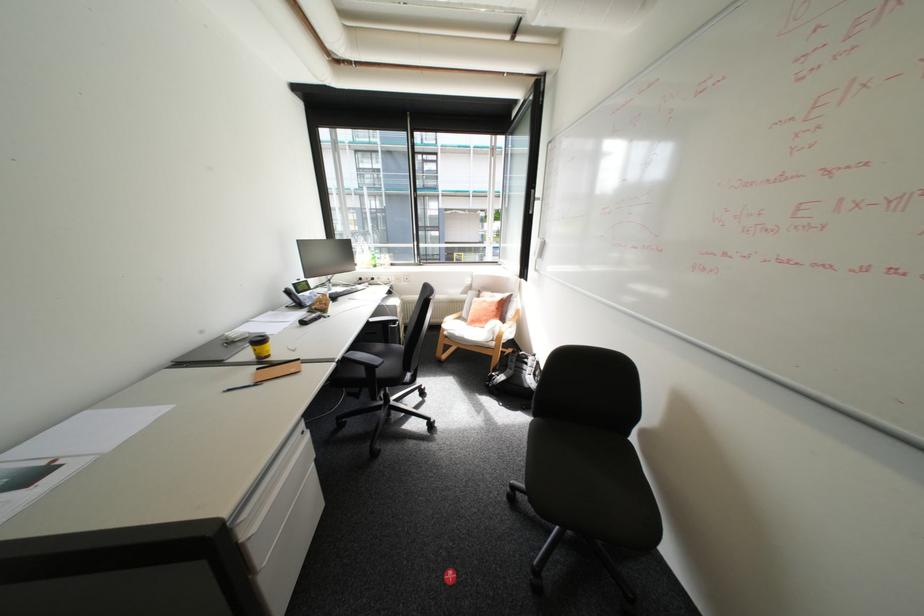
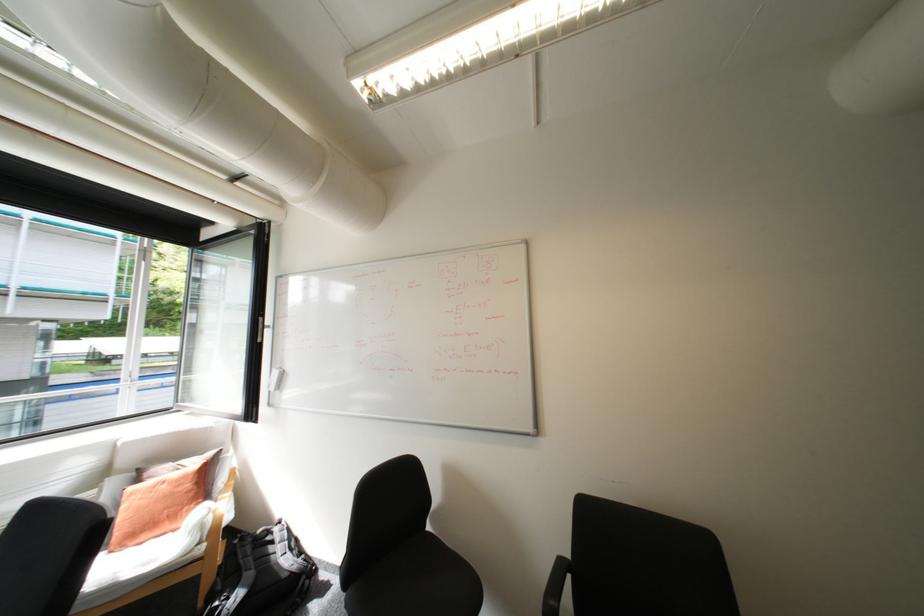
Where in the second image is the point corresponding to [507,376] from the first image?

(238, 599)